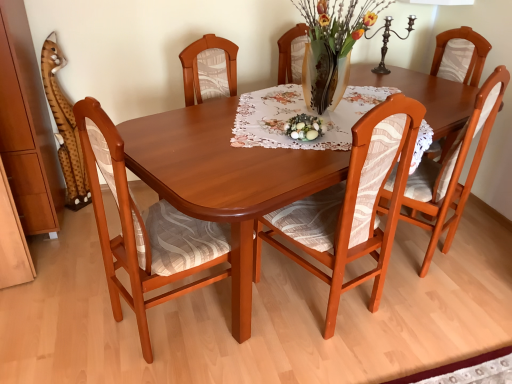
At what (x,y) coordinates should I click in order to perform the action: click on vacant region to the left of matte green glass bowl at center. Please return your answer as a coordinate pair (x, y). The image size is (512, 384). Looking at the image, I should click on (262, 132).